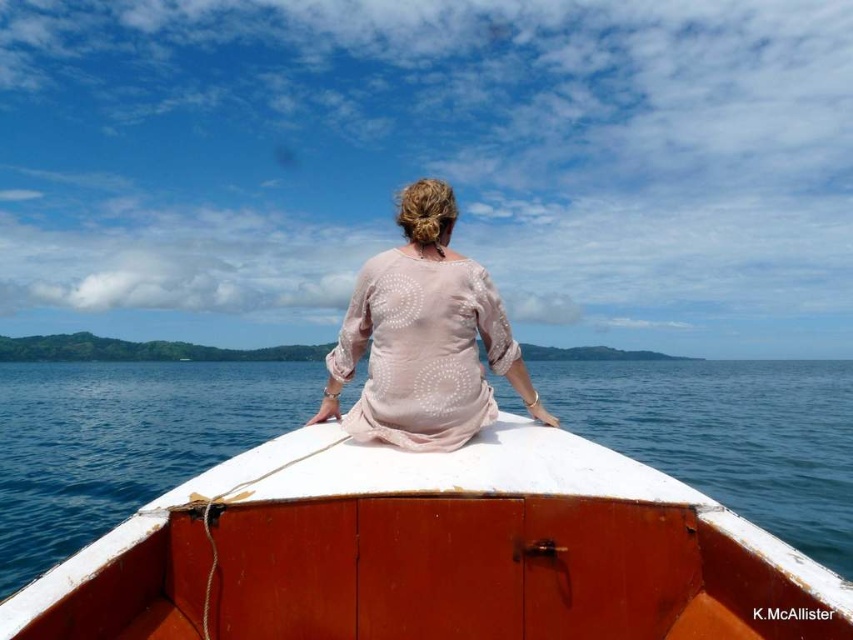
Can you confirm if white matte boat at center is positioned below pink sheer blouse at center?

Yes, white matte boat at center is below pink sheer blouse at center.

Where is `white matte boat at center`? white matte boat at center is located at coordinates (433, 552).

The width and height of the screenshot is (853, 640). What do you see at coordinates (433, 552) in the screenshot? I see `white matte boat at center` at bounding box center [433, 552].

The height and width of the screenshot is (640, 853). In order to click on white matte boat at center in this screenshot , I will do `click(433, 552)`.